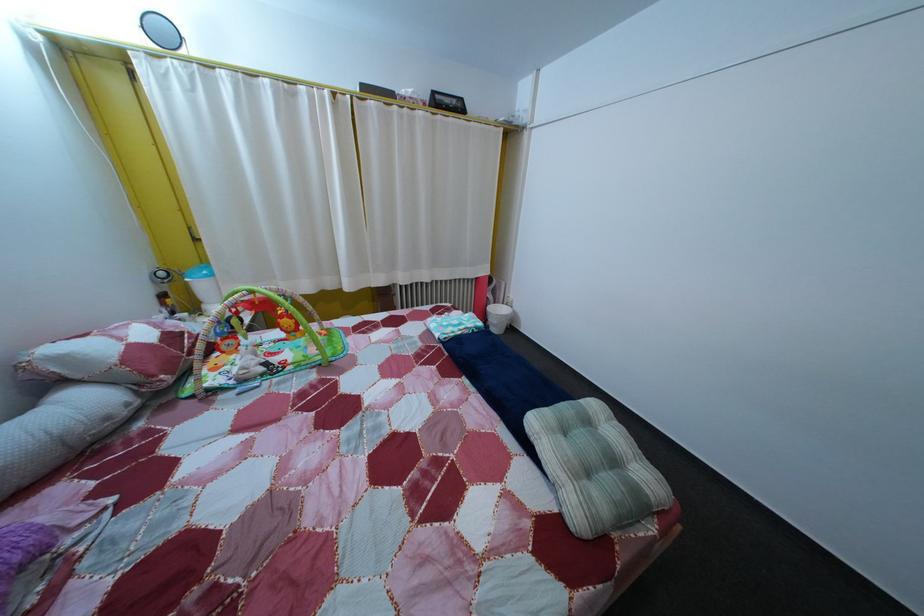
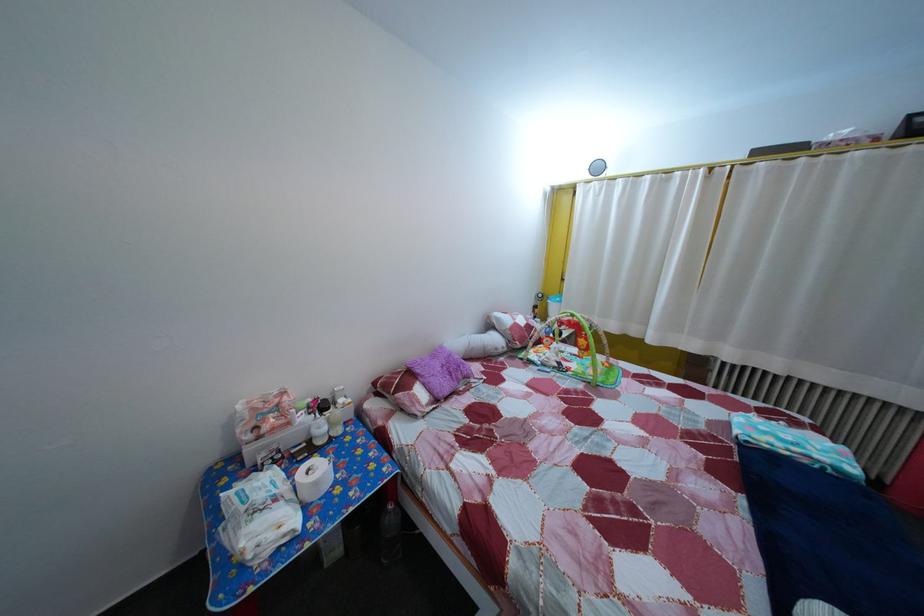
Where in the second image is the point corresponding to the point at 273,377 from the first image?

(565, 371)